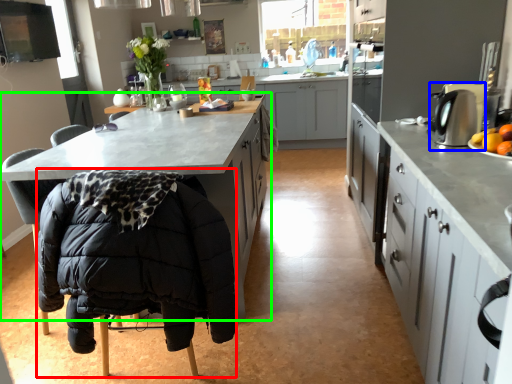
Question: Based on their relative distances, which object is farther from folding chair (highlighted by a red box)? Choose from kitchen appliance (highlighted by a blue box) and cabinetry (highlighted by a green box).

Choices:
 (A) kitchen appliance
 (B) cabinetry

Answer: (A)